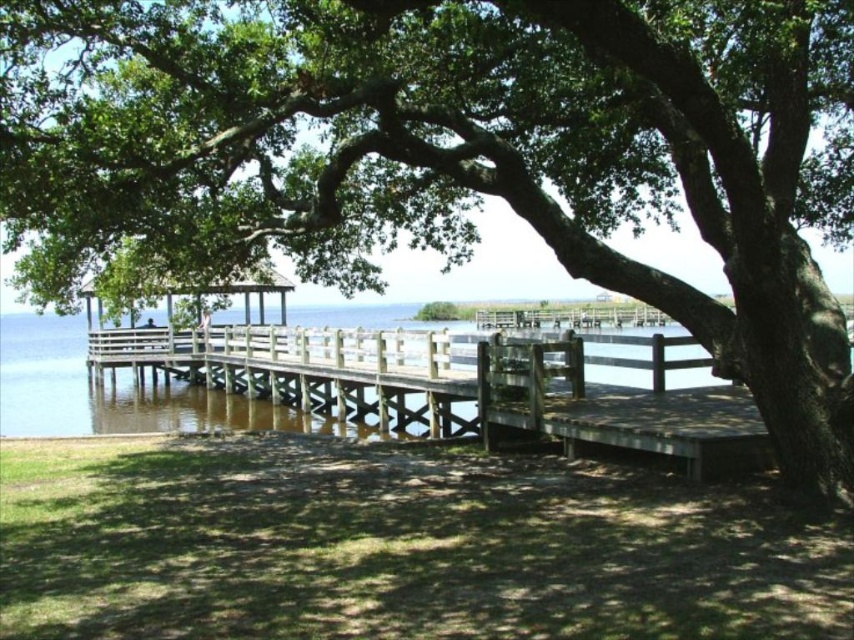
In the scene shown: Is wooden water at center to the right of white wooden gazebo at center from the viewer's perspective?

Yes, wooden water at center is to the right of white wooden gazebo at center.

Can you confirm if wooden water at center is positioned below white wooden gazebo at center?

Yes, wooden water at center is below white wooden gazebo at center.

You are a GUI agent. You are given a task and a screenshot of the screen. Output one action in this format:
    pyautogui.click(x=<x>, y=<y>)
    Task: Click on the wooden water at center
    Image resolution: width=854 pixels, height=640 pixels.
    Given the screenshot: What is the action you would take?
    (x=108, y=392)